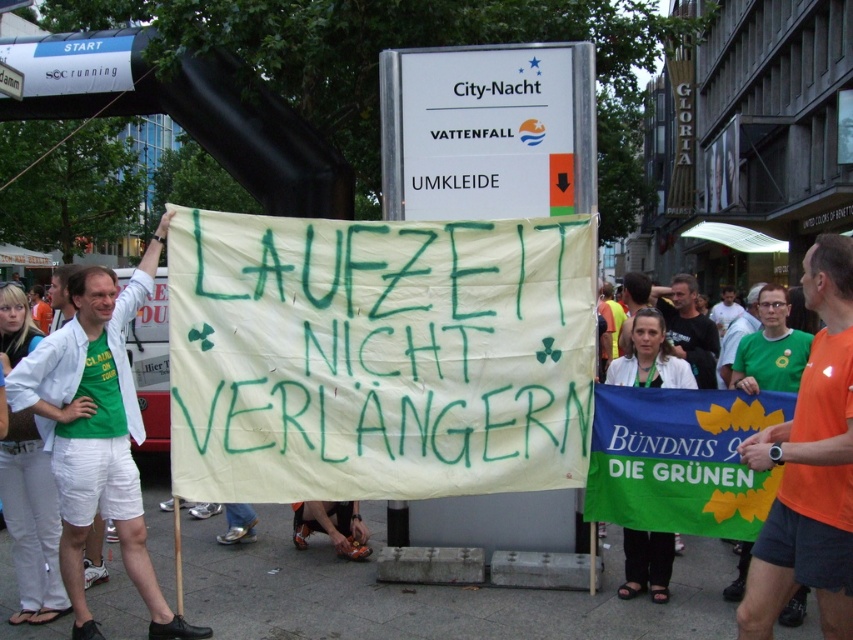
Question: Which point is farther to the camera?

Choices:
 (A) black cotton t-shirt at center
 (B) orange fabric shirt at center
 (C) green fabric banner at center

Answer: (A)

Question: Among these objects, which one is nearest to the camera?

Choices:
 (A) black cotton t-shirt at center
 (B) orange fabric shirt at center
 (C) white paper banner at center

Answer: (B)

Question: In this image, where is green fabric banner at center located relative to black cotton t-shirt at center?

Choices:
 (A) below
 (B) above

Answer: (A)

Question: Is green fabric banner at center thinner than black cotton t-shirt at center?

Choices:
 (A) no
 (B) yes

Answer: (B)

Question: Which object is farther from the camera taking this photo?

Choices:
 (A) black cotton t-shirt at center
 (B) green fabric shirt at left

Answer: (A)

Question: Where is white paper banner at center located in relation to orange t-shirt at center in the image?

Choices:
 (A) below
 (B) above

Answer: (A)